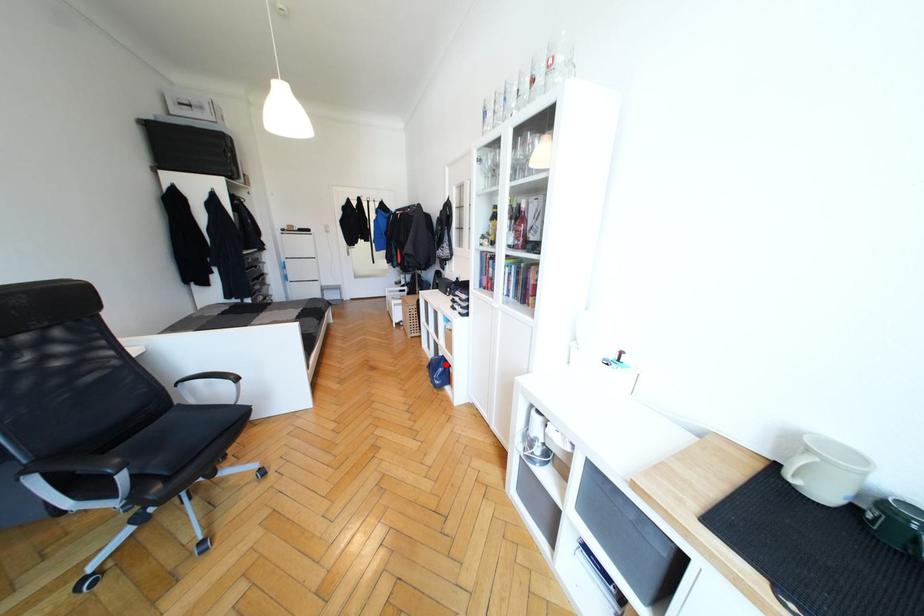
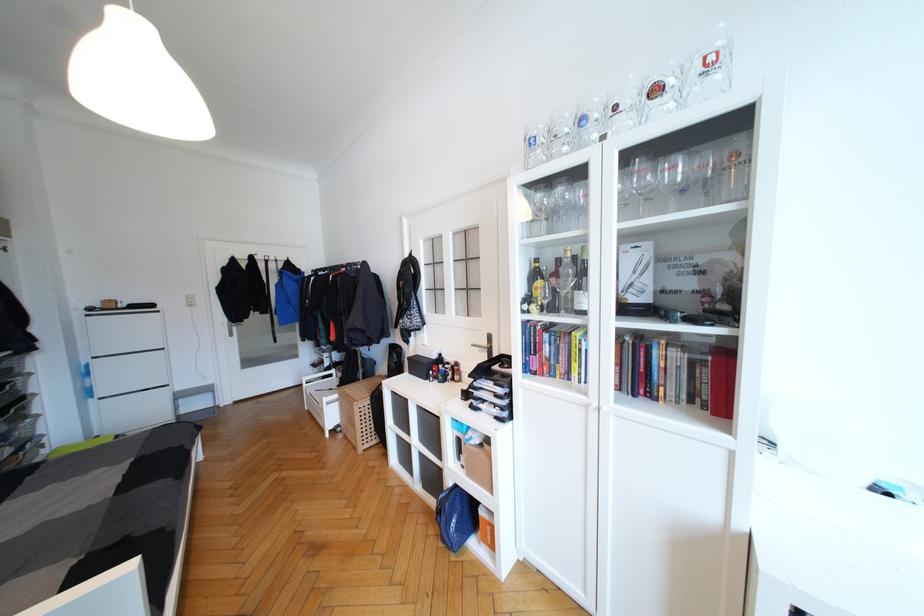
The point at the highlighted location is marked in the first image. Where is the corresponding point in the second image?

(460, 501)